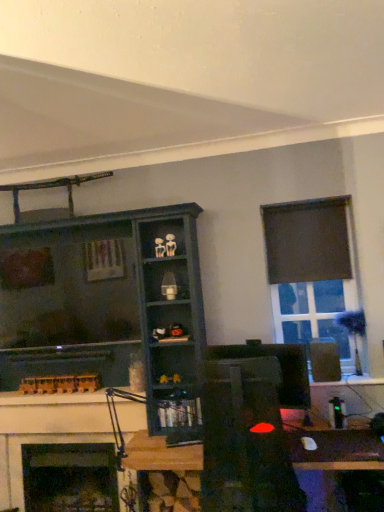
This screenshot has height=512, width=384. What do you see at coordinates (324, 360) in the screenshot?
I see `black plastic speaker at right` at bounding box center [324, 360].

The height and width of the screenshot is (512, 384). Identify the location of black fabric curtain at upper right. (307, 241).

Image resolution: width=384 pixels, height=512 pixels. What do you see at coordinates (45, 431) in the screenshot? I see `white painted wood fireplace at lower left` at bounding box center [45, 431].

Find the location of a particular element. metallic silver shelf at center, the 1th shelf when ordered from bottom to top is located at coordinates (179, 411).

From a real-world perspective, is matte black monitor at center above or below white painted wood fireplace at lower left?

From a real-world perspective, matte black monitor at center is physically above white painted wood fireplace at lower left.

Could white painted wood fireplace at lower left be considered to be inside matte black monitor at center?

No, white painted wood fireplace at lower left is not surrounded by matte black monitor at center.

How different are the orientations of matte black monitor at center and white painted wood fireplace at lower left in degrees?

The facing directions of matte black monitor at center and white painted wood fireplace at lower left are 0.00577 degrees apart.

Is point (132, 231) farther from viewer compared to point (294, 393)?

Yes, point (132, 231) is behind point (294, 393).

From the image's perspective, is dark wood shelf at center, which is the 2th shelf from right to left, below matte black monitor at center?

No.

Which of these two, dark wood shelf at center, which is the 2th shelf from right to left, or matte black monitor at center, is wider?

dark wood shelf at center, which is the 2th shelf from right to left, is wider.

Would you say dark wood shelf at center, which is the first shelf in left-to-right order, is inside or outside matte black monitor at center?

The correct answer is: outside.

Between white painted wood fireplace at lower left and black plastic speaker at right, which one has smaller size?

black plastic speaker at right.

Is white painted wood fireplace at lower left looking in the opposite direction of black plastic speaker at right?

No, white painted wood fireplace at lower left is not facing the opposite direction of black plastic speaker at right.

How far apart are white painted wood fireplace at lower left and black plastic speaker at right?

white painted wood fireplace at lower left and black plastic speaker at right are 1.72 meters apart from each other.

Choose the correct answer: Is white painted wood fireplace at lower left inside black plastic speaker at right or outside it?

The correct answer is: outside.

How far apart are metallic silver shelf at center, which is the 2th shelf in left-to-right order, and white painted wood fireplace at lower left?

metallic silver shelf at center, which is the 2th shelf in left-to-right order, is 27.73 inches from white painted wood fireplace at lower left.

Between metallic silver shelf at center, the 1th shelf when ordered from bottom to top, and white painted wood fireplace at lower left, which one has smaller width?

With smaller width is white painted wood fireplace at lower left.

Which is in front, metallic silver shelf at center, the 1th shelf when ordered from bottom to top, or white painted wood fireplace at lower left?

metallic silver shelf at center, the 1th shelf when ordered from bottom to top, is closer to the camera.

From the image's perspective, is metallic silver shelf at center, the 1th shelf from the right, positioned above or below white painted wood fireplace at lower left?

Clearly, from the image's perspective, metallic silver shelf at center, the 1th shelf from the right, is above white painted wood fireplace at lower left.

Based on the photo, can you confirm if dark wood shelf at center, which is the first shelf in left-to-right order, is shorter than black plastic speaker at right?

In fact, dark wood shelf at center, which is the first shelf in left-to-right order, may be taller than black plastic speaker at right.

Identify the location of speaker on the right of dark wood shelf at center, which is the first shelf in left-to-right order. (324, 360).

Does dark wood shelf at center, marked as the first shelf in a top-to-bottom arrangement, have a smaller size compared to black plastic speaker at right?

Actually, dark wood shelf at center, marked as the first shelf in a top-to-bottom arrangement, might be larger than black plastic speaker at right.

From the image's perspective, who appears lower, dark wood shelf at center, positioned as the second shelf in bottom-to-top order, or black plastic speaker at right?

dark wood shelf at center, positioned as the second shelf in bottom-to-top order.

From a real-world perspective, relative to dark wood shelf at center, which is the first shelf in left-to-right order, is black fabric curtain at upper right vertically above or below?

In terms of real-world spatial position, black fabric curtain at upper right is above dark wood shelf at center, which is the first shelf in left-to-right order.

Who is bigger, black fabric curtain at upper right or dark wood shelf at center, positioned as the second shelf in bottom-to-top order?

Bigger between the two is dark wood shelf at center, positioned as the second shelf in bottom-to-top order.

Between black fabric curtain at upper right and dark wood shelf at center, positioned as the second shelf in bottom-to-top order, which one has larger width?

Wider between the two is dark wood shelf at center, positioned as the second shelf in bottom-to-top order.

Is black fabric curtain at upper right facing towards dark wood shelf at center, marked as the first shelf in a top-to-bottom arrangement?

No, black fabric curtain at upper right is not oriented towards dark wood shelf at center, marked as the first shelf in a top-to-bottom arrangement.

At what (x,y) coordinates should I click in order to perform the action: click on curtain on the right side of white painted wood fireplace at lower left. Please return your answer as a coordinate pair (x, y). The image size is (384, 512). Looking at the image, I should click on (307, 241).

Is white painted wood fireplace at lower left positioned beyond the bounds of black fabric curtain at upper right?

Yes, white painted wood fireplace at lower left is located beyond the bounds of black fabric curtain at upper right.

Which object is thinner, white painted wood fireplace at lower left or black fabric curtain at upper right?

With smaller width is black fabric curtain at upper right.

You are a GUI agent. You are given a task and a screenshot of the screen. Output one action in this format:
    pyautogui.click(x=<x>, y=<y>)
    Task: Click on the computer monitor in front of the white painted wood fireplace at lower left
    
    Given the screenshot: What is the action you would take?
    pyautogui.click(x=280, y=368)

Locate an element on the screen. This screenshot has width=384, height=512. shelf that is the 2nd one when counting leftward from the matte black monitor at center is located at coordinates (106, 307).

Considering their positions, is black plastic speaker at right positioned closer to white painted wood fireplace at lower left than wooden desk at center?

wooden desk at center is positioned closer to the anchor white painted wood fireplace at lower left.

From the image, which object appears to be farther from dark matte window at upper right, black fabric curtain at upper right or white painted wood fireplace at lower left?

white painted wood fireplace at lower left.

When comparing their distances from metallic silver shelf at center, which is the 2th shelf in left-to-right order, does dark matte window at upper right or black plastic speaker at right seem closer?

The object closer to metallic silver shelf at center, which is the 2th shelf in left-to-right order, is black plastic speaker at right.

From the image, which object appears to be farther from wooden desk at center, metallic silver shelf at center, the 1th shelf when ordered from bottom to top, or black fabric curtain at upper right?

Among the two, black fabric curtain at upper right is located further to wooden desk at center.

Considering their positions, is dark matte window at upper right positioned closer to white painted wood fireplace at lower left than black fabric curtain at upper right?

dark matte window at upper right is positioned closer to the anchor white painted wood fireplace at lower left.

Which object lies nearer to the anchor point wooden desk at center, dark wood shelf at center, marked as the first shelf in a top-to-bottom arrangement, or matte black monitor at center?

matte black monitor at center is positioned closer to the anchor wooden desk at center.

Which object lies nearer to the anchor point dark wood shelf at center, positioned as the second shelf in bottom-to-top order, white painted wood fireplace at lower left or dark matte window at upper right?

white painted wood fireplace at lower left is closer to dark wood shelf at center, positioned as the second shelf in bottom-to-top order.

Which object lies further to the anchor point dark wood shelf at center, marked as the first shelf in a top-to-bottom arrangement, dark matte window at upper right or black plastic speaker at right?

black plastic speaker at right is further to dark wood shelf at center, marked as the first shelf in a top-to-bottom arrangement.

Image resolution: width=384 pixels, height=512 pixels. I want to click on computer monitor between dark wood shelf at center, which is the 2th shelf from right to left, and black fabric curtain at upper right from left to right, so click(280, 368).

The image size is (384, 512). What are the coordinates of `computer monitor between metallic silver shelf at center, which is the 2th shelf in left-to-right order, and black plastic speaker at right` in the screenshot? It's located at (280, 368).

Image resolution: width=384 pixels, height=512 pixels. What are the coordinates of `speaker between matte black monitor at center and dark matte window at upper right in the horizontal direction` in the screenshot? It's located at (324, 360).

I want to click on shelf between dark wood shelf at center, which is the 2th shelf from right to left, and dark matte window at upper right, so click(x=179, y=411).